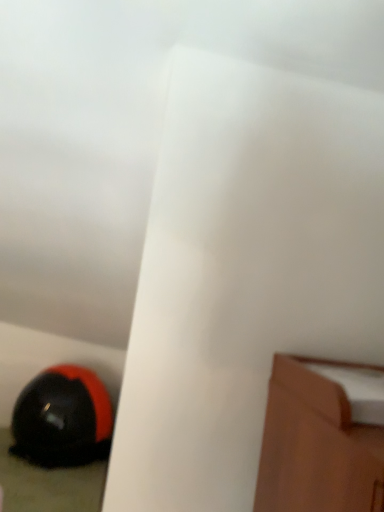
What do you see at coordinates (63, 418) in the screenshot? I see `black matte helmet at lower left` at bounding box center [63, 418].

You are a GUI agent. You are given a task and a screenshot of the screen. Output one action in this format:
    pyautogui.click(x=<x>, y=<y>)
    Task: Click on the black matte helmet at lower left
    
    Given the screenshot: What is the action you would take?
    pyautogui.click(x=63, y=418)

Locate an element on the screen. This screenshot has height=512, width=384. black matte helmet at lower left is located at coordinates (63, 418).